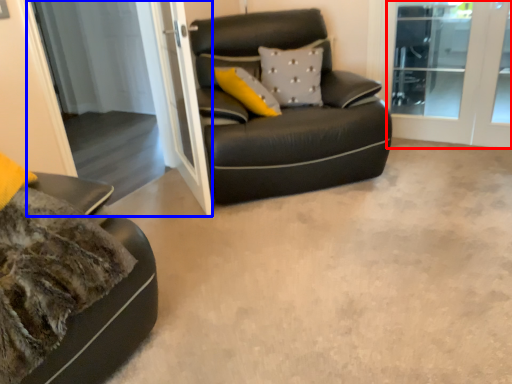
Question: Which point is closer to the camera, screen door (highlighted by a red box) or screen door (highlighted by a blue box)?

Choices:
 (A) screen door
 (B) screen door

Answer: (B)